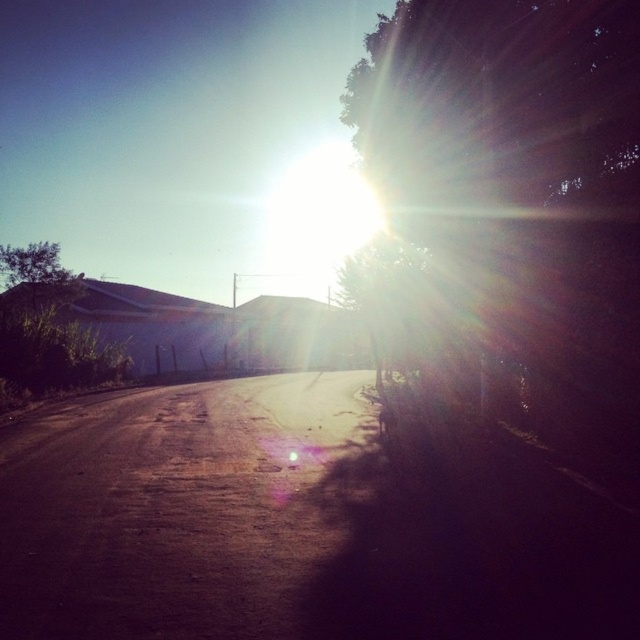
Does dull brown dirt track at center appear under green leafy tree at upper left?

Yes, dull brown dirt track at center is below green leafy tree at upper left.

Does dull brown dirt track at center appear on the right side of green leafy tree at upper left?

Indeed, dull brown dirt track at center is positioned on the right side of green leafy tree at upper left.

At what (x,y) coordinates should I click in order to perform the action: click on dull brown dirt track at center. Please return your answer as a coordinate pair (x, y). The image size is (640, 640). Looking at the image, I should click on (177, 508).

Where is `dull brown dirt track at center`? dull brown dirt track at center is located at coordinates (177, 508).

Does green leafy tree at upper right have a greater width compared to green leafy tree at upper left?

Yes, green leafy tree at upper right is wider than green leafy tree at upper left.

Does green leafy tree at upper right come in front of green leafy tree at upper left?

Yes, it is.

Between point (484, 241) and point (61, 340), which one is positioned behind?

Point (61, 340)

This screenshot has width=640, height=640. Find the location of `green leafy tree at upper right`. green leafy tree at upper right is located at coordinates (520, 180).

At what (x,y) coordinates should I click in order to perform the action: click on green leafy tree at upper right. Please return your answer as a coordinate pair (x, y). The image size is (640, 640). Looking at the image, I should click on click(x=520, y=180).

Does green leafy tree at upper right have a lesser width compared to dull brown dirt track at center?

Yes.

Between point (630, 49) and point (156, 572), which one is positioned in front?

Point (156, 572)

This screenshot has width=640, height=640. In order to click on green leafy tree at upper right in this screenshot , I will do `click(520, 180)`.